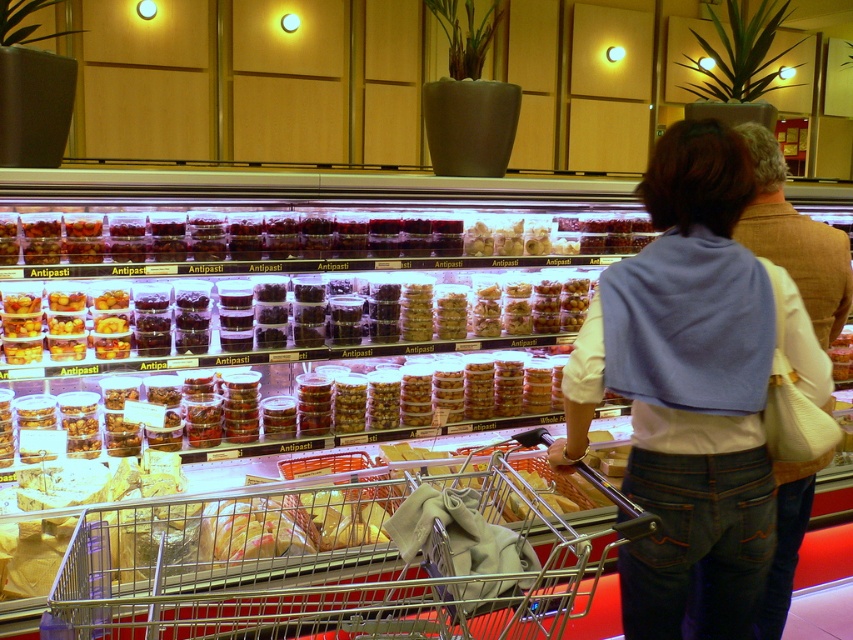
Question: Where is metallic silver shopping cart at center located in relation to denim jacket at center in the image?

Choices:
 (A) above
 (B) below

Answer: (B)

Question: Which object appears closest to the camera in this image?

Choices:
 (A) denim jacket at center
 (B) white fabric bag at right

Answer: (A)

Question: Which of the following is the farthest from the observer?

Choices:
 (A) denim jacket at center
 (B) metallic silver shopping cart at center
 (C) white fabric bag at right

Answer: (C)

Question: Does metallic silver shopping cart at center have a smaller size compared to translucent plastic containers at center?

Choices:
 (A) yes
 (B) no

Answer: (B)

Question: Is metallic silver shopping cart at center thinner than white fabric bag at right?

Choices:
 (A) no
 (B) yes

Answer: (A)

Question: Estimate the real-world distances between objects in this image. Which object is farther from the translucent plastic containers at center?

Choices:
 (A) metallic silver shopping cart at center
 (B) white fabric bag at right

Answer: (A)